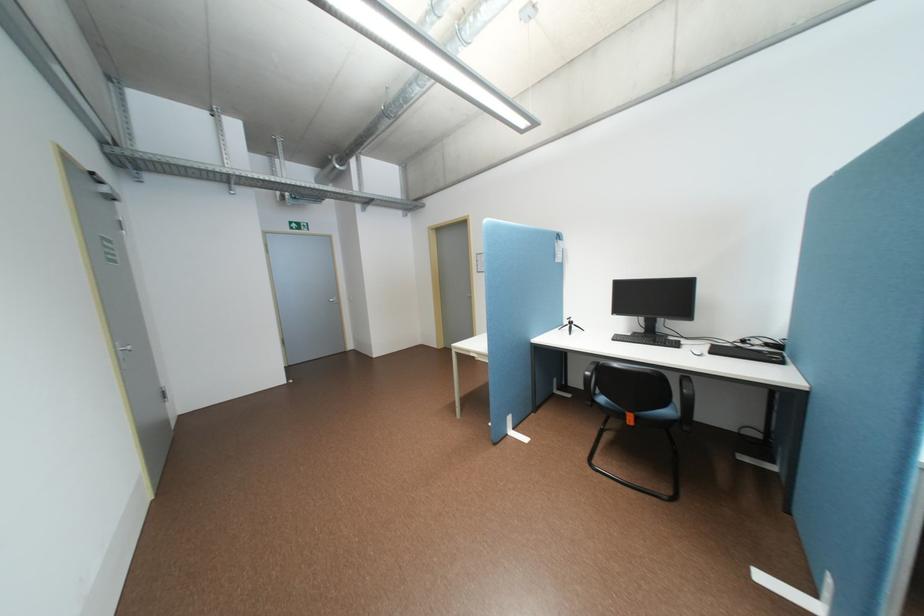
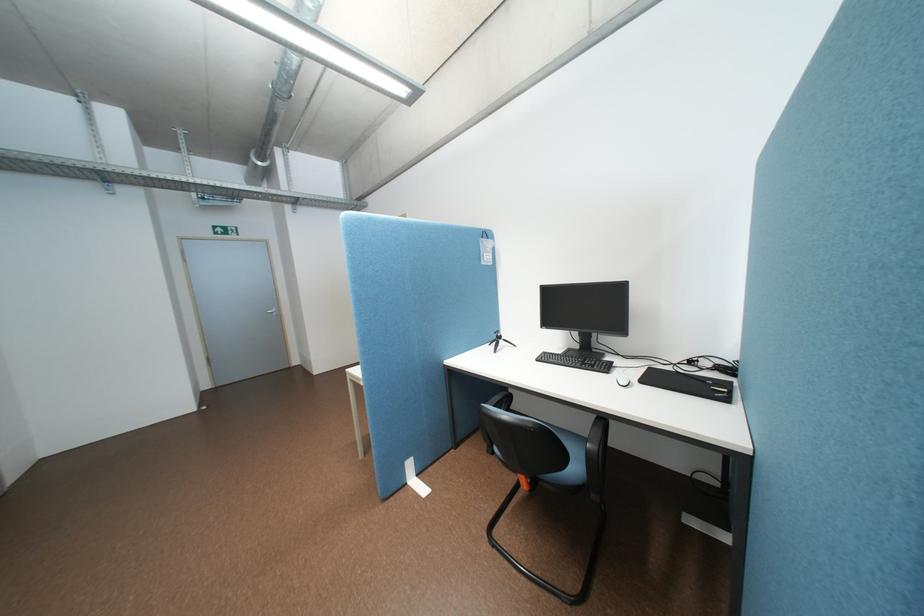
Question: Based on the continuous images, in which direction is the camera rotating? Reply with the corresponding letter.

Choices:
 (A) Left
 (B) Right
 (C) Up
 (D) Down

Answer: (C)